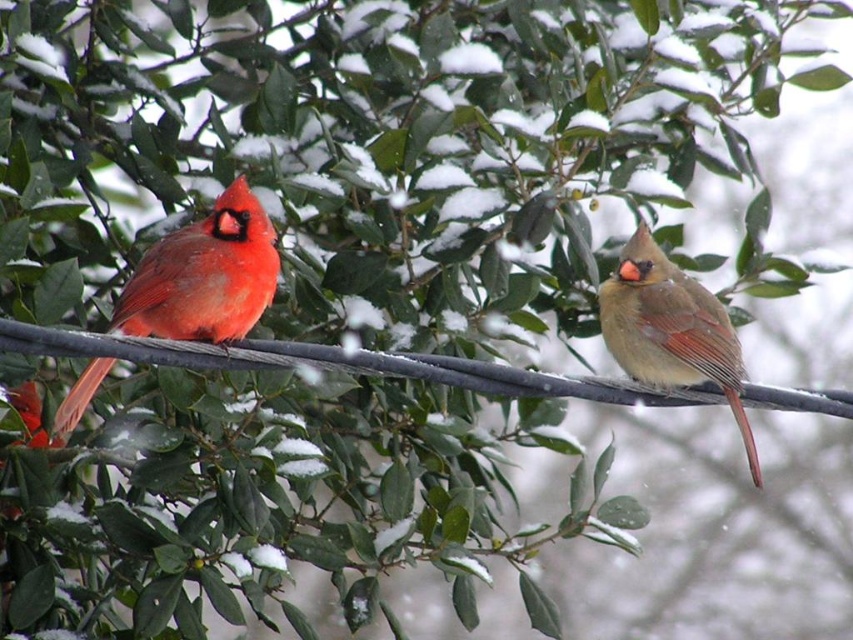
You are standing in the snowy landscape looking at the two birds. Which point, point (189, 276) or point (747, 438), is closer to you?

Point (189, 276) is closer to you because it is in front of point (747, 438).

You are a photographer aiming to capture a closeup of the matte red cardinal at left. Based on its coordinates, where should you focus your camera lens?

The matte red cardinal at left is located at coordinates point (x=204, y=275), so you should focus your camera lens at that position to capture a closeup.

You are holding a camera and want to take a photo of the matte red cardinal at left. If you are currently 1.89 meters away from it, is this a suitable distance for capturing a clear, detailed photo of the bird without causing disturbance?

Yes, the matte red cardinal at left is 1.89 meters away from the camera, which is a suitable distance for capturing a clear, detailed photo without disturbing the bird.